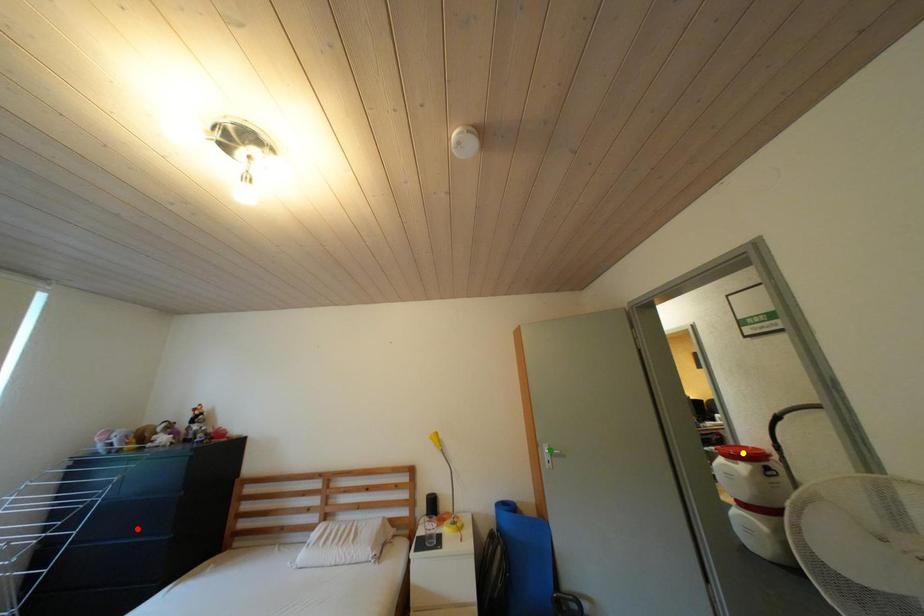
Order these from farthest to nearest:
- red point
- yellow point
- green point

yellow point, green point, red point